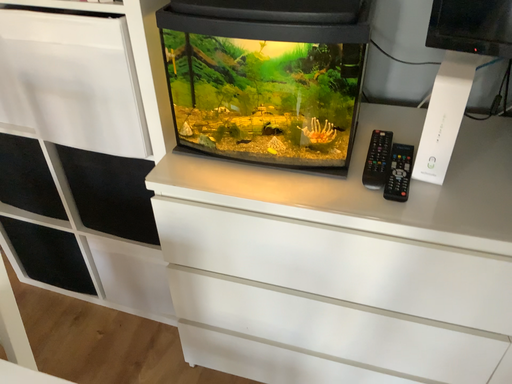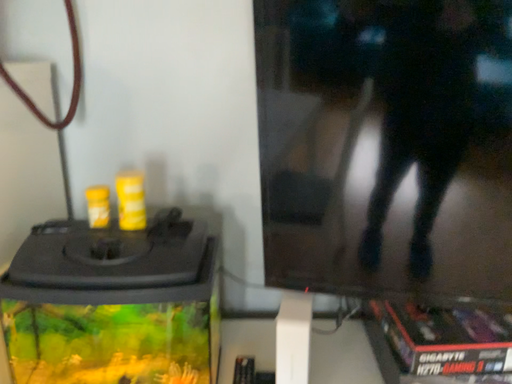
Question: How did the camera likely rotate when shooting the video?

Choices:
 (A) rotated downward
 (B) rotated upward

Answer: (B)